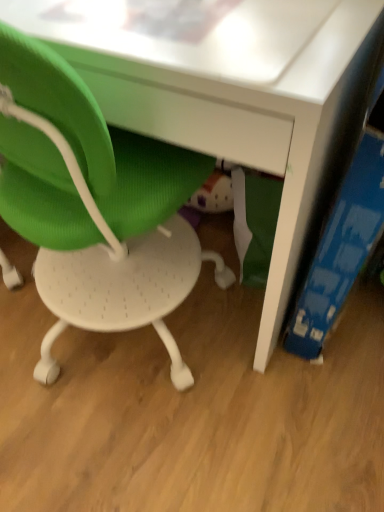
This screenshot has width=384, height=512. In order to click on vacant area that lies in front of blue cardboard book at right in this screenshot , I will do `click(329, 387)`.